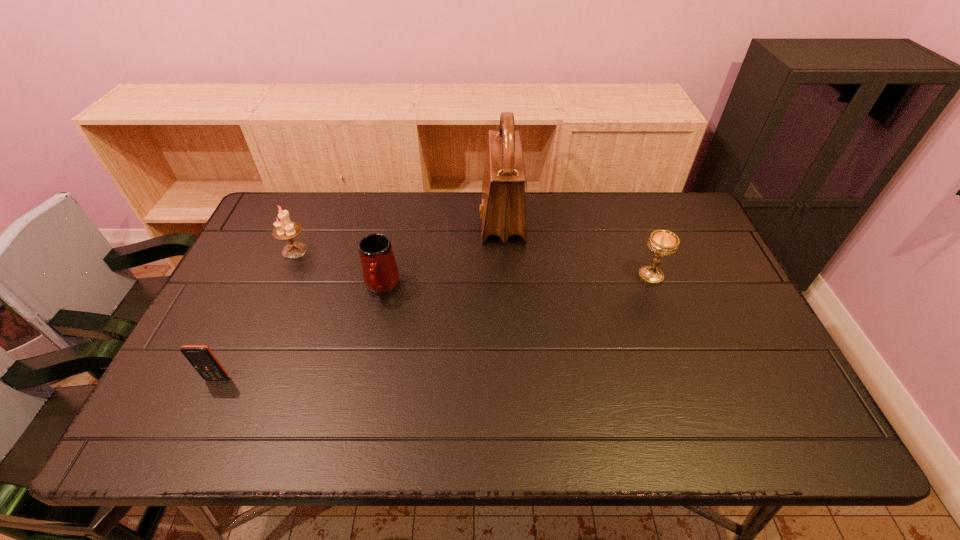
Locate an element on the screen. free point between the candle holder and the second object from right to left is located at coordinates (398, 235).

Find the location of `free area in between the tallest object and the nearest object`. free area in between the tallest object and the nearest object is located at coordinates (360, 299).

The image size is (960, 540). In order to click on vacant space that is in between the shoulder bag and the nearest object in this screenshot , I will do `click(360, 299)`.

You are a GUI agent. You are given a task and a screenshot of the screen. Output one action in this format:
    pyautogui.click(x=<x>, y=<y>)
    Task: Click on the empty space that is in between the candle holder and the chalice
    
    Given the screenshot: What is the action you would take?
    point(472,263)

The width and height of the screenshot is (960, 540). I want to click on vacant space that is in between the rightmost object and the third object from right to left, so click(516, 281).

Where is `unoccupied area between the chalice and the candle holder`? The image size is (960, 540). unoccupied area between the chalice and the candle holder is located at coordinates (472, 263).

Where is `vacant area that lies between the third object from left to right and the shoulder bag`? The width and height of the screenshot is (960, 540). vacant area that lies between the third object from left to right and the shoulder bag is located at coordinates (442, 253).

Where is `free space that is in between the shoulder bag and the third object from right to left`? The width and height of the screenshot is (960, 540). free space that is in between the shoulder bag and the third object from right to left is located at coordinates (442, 253).

Where is `vacant region between the cellular telephone and the rightmost object`? vacant region between the cellular telephone and the rightmost object is located at coordinates (434, 327).

The height and width of the screenshot is (540, 960). In order to click on free space that is in between the cellular telephone and the shoulder bag in this screenshot , I will do `click(360, 299)`.